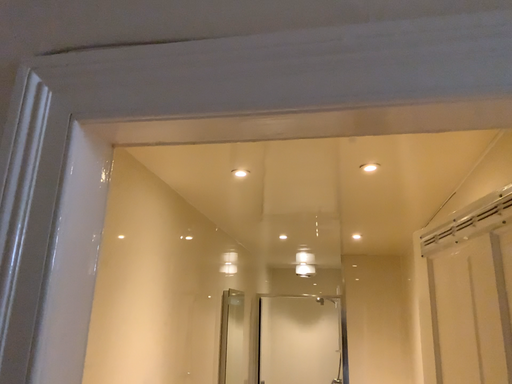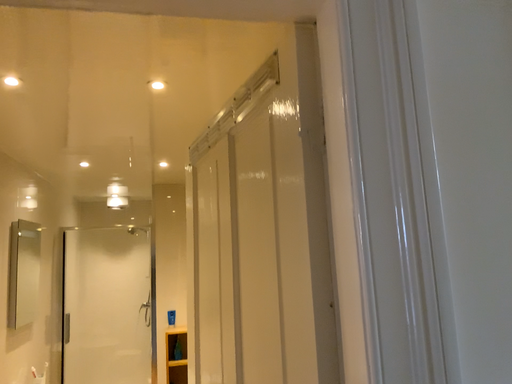
Question: Which way did the camera rotate in the video?

Choices:
 (A) rotated left
 (B) rotated right

Answer: (B)